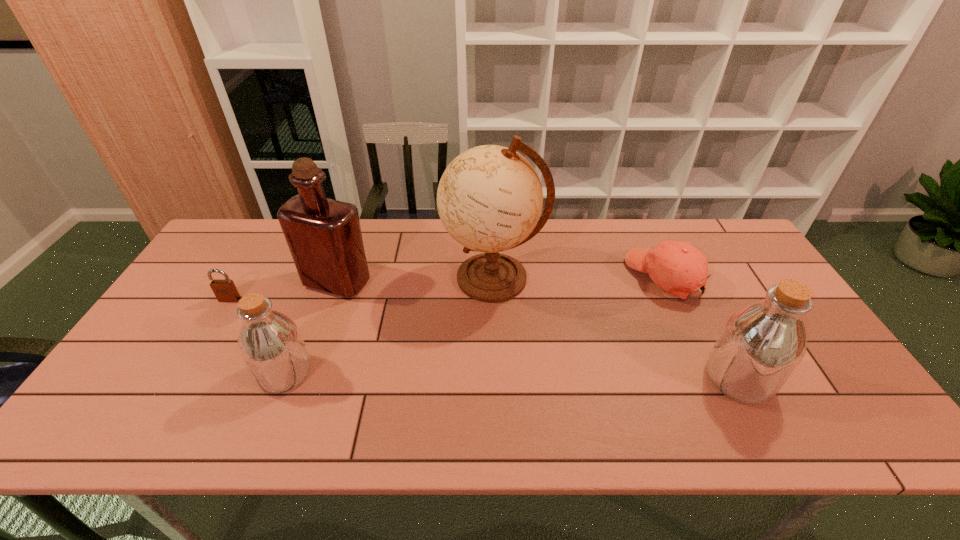
I want to click on vacant space in between the shorter bottle and the right bottle, so click(x=512, y=376).

Find the location of a particular element. The height and width of the screenshot is (540, 960). free area in between the fourth shortest object and the third shortest object is located at coordinates (512, 376).

Locate an element on the screen. This screenshot has height=540, width=960. object that is the fifth closest to the left bottle is located at coordinates (761, 345).

I want to click on object that is the nearest to the baseball cap, so click(x=761, y=345).

Where is `vacant area in the image that satisfies the following two spatial constraints: 1. on the back side of the baseball cap; 2. on the left side of the liquor`? The height and width of the screenshot is (540, 960). vacant area in the image that satisfies the following two spatial constraints: 1. on the back side of the baseball cap; 2. on the left side of the liquor is located at coordinates (339, 278).

The width and height of the screenshot is (960, 540). I want to click on vacant space that satisfies the following two spatial constraints: 1. on the surface of the fourth object from left to right; 2. on the front-facing side of the padlock, so click(x=494, y=299).